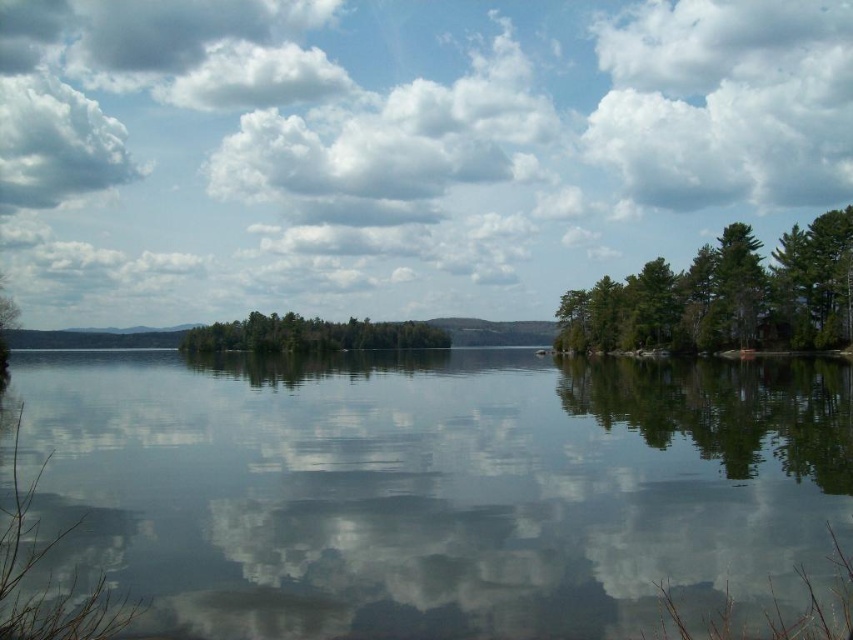
Does cloudy sky at upper center have a lesser height compared to cloudy sky at upper left?

No.

What do you see at coordinates (398, 147) in the screenshot? Image resolution: width=853 pixels, height=640 pixels. I see `cloudy sky at upper center` at bounding box center [398, 147].

Locate an element on the screen. cloudy sky at upper center is located at coordinates (398, 147).

From the picture: Does cloudy sky at upper center appear over green matte trees at center?

Yes, cloudy sky at upper center is above green matte trees at center.

Can you confirm if cloudy sky at upper center is taller than green matte trees at center?

Yes, cloudy sky at upper center is taller than green matte trees at center.

Identify the location of cloudy sky at upper center. This screenshot has height=640, width=853. (398, 147).

Is the position of transparent water at center more distant than that of cloudy sky at upper left?

No.

Between transparent water at center and cloudy sky at upper left, which one is positioned higher?

cloudy sky at upper left is above.

Locate an element on the screen. This screenshot has width=853, height=640. transparent water at center is located at coordinates (438, 488).